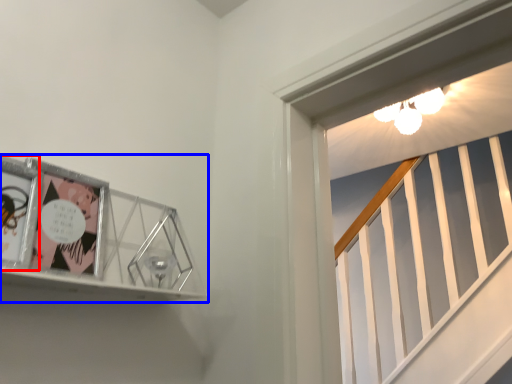
Question: Which point is further to the camera, comic book (highlighted by a red box) or picture frame (highlighted by a blue box)?

Choices:
 (A) comic book
 (B) picture frame

Answer: (A)